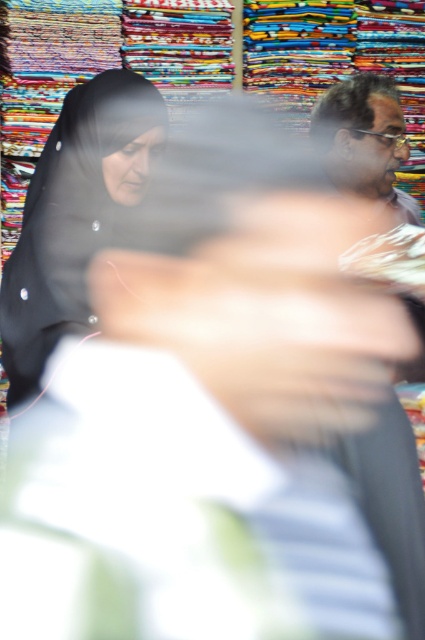
You are standing at the entrance of the market and see the matte black headscarf at left. Can you determine its exact position relative to the entrance?

The matte black headscarf at left is located at point [73,216], which means it is positioned approximately one third of the way from the left edge and just below the top edge of the image. Since you are at the entrance, this would place it to your left side and slightly above eye level.

You are a customer in the market and want to buy the matte black headscarf at left and the matte gray shirt at upper right. Which item is located higher in the image?

The matte gray shirt at upper right is higher in the image than the matte black headscarf at left.